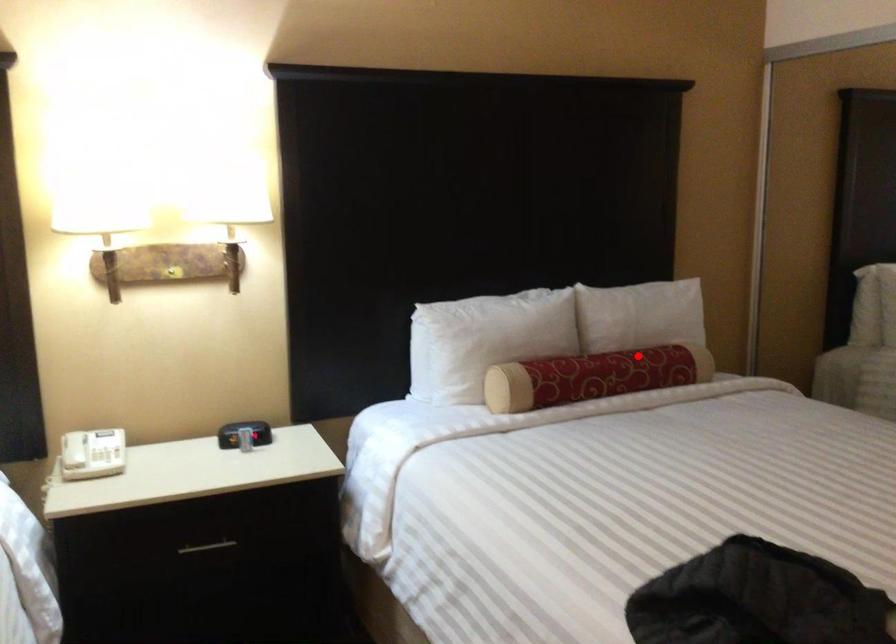
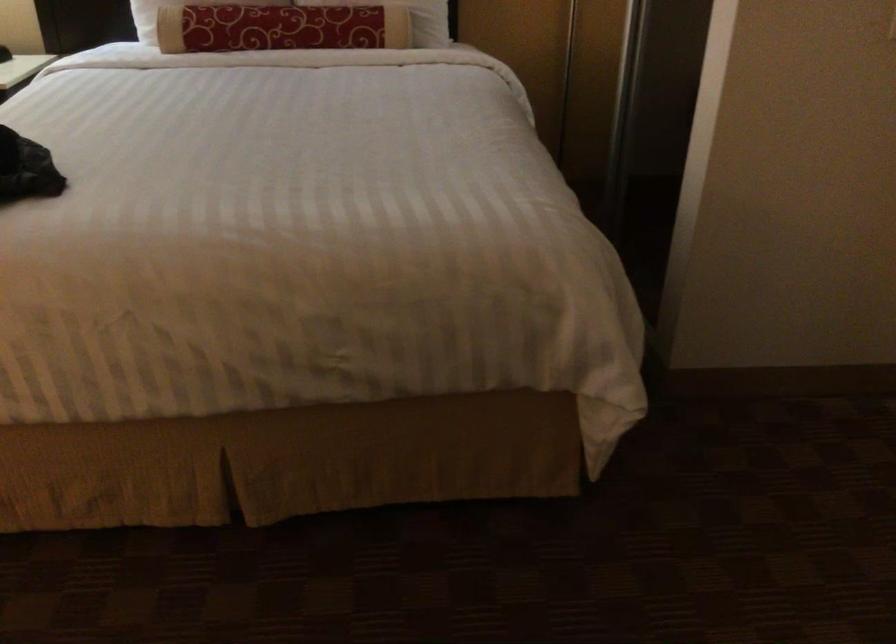
Locate, in the second image, the point that corresponds to the highlighted location in the first image.

(311, 15)